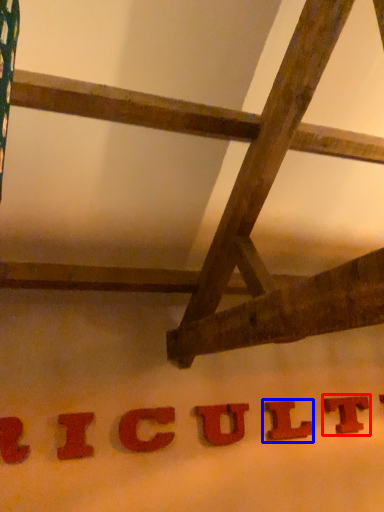
Question: Which of the following is the farthest to the observer, letter (highlighted by a red box) or letter (highlighted by a blue box)?

Choices:
 (A) letter
 (B) letter

Answer: (A)